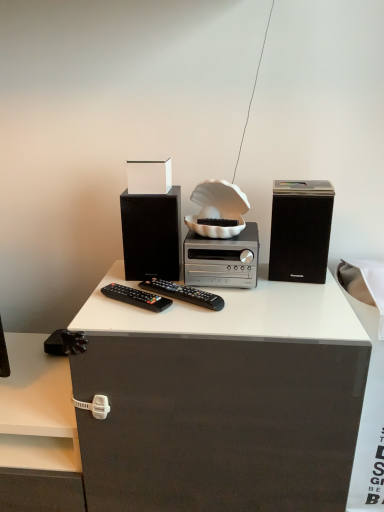
Question: Which direction should I rotate to face black plastic remote at center, which is the 2th remote control in right-to-left order, — up or down?

Choices:
 (A) up
 (B) down

Answer: (B)

Question: From a real-world perspective, is matte black speaker at center, which is the second speaker in right-to-left order, on matte black cabinet at right?

Choices:
 (A) yes
 (B) no

Answer: (A)

Question: Can you confirm if matte black speaker at center, the first speaker viewed from the left, is wider than matte black cabinet at right?

Choices:
 (A) no
 (B) yes

Answer: (A)

Question: Considering the relative sizes of matte black speaker at center, the first speaker viewed from the left, and matte black cabinet at right in the image provided, is matte black speaker at center, the first speaker viewed from the left, smaller than matte black cabinet at right?

Choices:
 (A) no
 (B) yes

Answer: (B)

Question: Is matte black speaker at center, the first speaker viewed from the left, oriented away from matte black cabinet at right?

Choices:
 (A) no
 (B) yes

Answer: (A)

Question: From a real-world perspective, is matte black speaker at center, the first speaker viewed from the left, located beneath matte black cabinet at right?

Choices:
 (A) no
 (B) yes

Answer: (A)

Question: Can you confirm if matte black speaker at center, the first speaker viewed from the left, is shorter than matte black cabinet at right?

Choices:
 (A) no
 (B) yes

Answer: (B)

Question: Is matte black speaker at center, which is the second speaker in right-to-left order, thinner than silver metallic stereo at center?

Choices:
 (A) no
 (B) yes

Answer: (B)

Question: Can you confirm if matte black speaker at center, which is the second speaker in right-to-left order, is taller than silver metallic stereo at center?

Choices:
 (A) no
 (B) yes

Answer: (B)

Question: Are matte black speaker at center, the first speaker viewed from the left, and silver metallic stereo at center located far from each other?

Choices:
 (A) no
 (B) yes

Answer: (A)

Question: Is silver metallic stereo at center at the back of matte black speaker at center, which is the second speaker in right-to-left order?

Choices:
 (A) yes
 (B) no

Answer: (B)

Question: From the image's perspective, is matte black speaker at center, which is the second speaker in right-to-left order, above silver metallic stereo at center?

Choices:
 (A) no
 (B) yes

Answer: (B)

Question: Considering the relative sizes of matte black speaker at center, which is the second speaker in right-to-left order, and silver metallic stereo at center in the image provided, is matte black speaker at center, which is the second speaker in right-to-left order, smaller than silver metallic stereo at center?

Choices:
 (A) yes
 (B) no

Answer: (A)

Question: From a real-world perspective, is black matte speaker at right, the 1th speaker from the right, over matte black speaker at center, the first speaker viewed from the left?

Choices:
 (A) yes
 (B) no

Answer: (A)